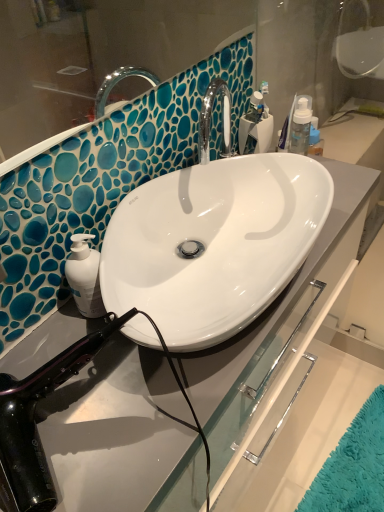
Describe the element at coordinates (256, 126) in the screenshot. This screenshot has height=512, width=384. I see `clear plastic toothbrush holder at upper right` at that location.

Image resolution: width=384 pixels, height=512 pixels. I want to click on clear plastic toothbrush holder at upper right, so click(256, 126).

At what (x,y) coordinates should I click in order to perform the action: click on black glossy hair dryer at lower left. Please return your answer as a coordinate pair (x, y). The image size is (384, 512). Looking at the image, I should click on (35, 423).

The height and width of the screenshot is (512, 384). What do you see at coordinates (35, 423) in the screenshot?
I see `black glossy hair dryer at lower left` at bounding box center [35, 423].

Measure the distance between point (37, 385) and camera.

The depth of point (37, 385) is 28.23 inches.

What are the coordinates of `clear plastic toothbrush holder at upper right` in the screenshot? It's located at (x=256, y=126).

Can you confirm if black glossy hair dryer at lower left is positioned to the left of clear plastic toothbrush holder at upper right?

Yes, black glossy hair dryer at lower left is to the left of clear plastic toothbrush holder at upper right.

Considering the relative positions of black glossy hair dryer at lower left and clear plastic toothbrush holder at upper right in the image provided, is black glossy hair dryer at lower left behind clear plastic toothbrush holder at upper right?

No.

Which is in front, point (3, 447) or point (242, 132)?

The point (3, 447) is in front.

From the image's perspective, does black glossy hair dryer at lower left appear higher than clear plastic toothbrush holder at upper right?

No, from the image's perspective, black glossy hair dryer at lower left is not on top of clear plastic toothbrush holder at upper right.

In the scene shown: From a real-world perspective, between black glossy hair dryer at lower left and clear plastic toothbrush holder at upper right, who is vertically lower?

clear plastic toothbrush holder at upper right.

Considering the sizes of black glossy hair dryer at lower left and clear plastic toothbrush holder at upper right in the image, is black glossy hair dryer at lower left wider or thinner than clear plastic toothbrush holder at upper right?

Considering their sizes, black glossy hair dryer at lower left looks broader than clear plastic toothbrush holder at upper right.

Between black glossy hair dryer at lower left and clear plastic toothbrush holder at upper right, which one has more height?

Standing taller between the two is black glossy hair dryer at lower left.

Does black glossy hair dryer at lower left have a larger size compared to clear plastic toothbrush holder at upper right?

Yes.

Do you think black glossy hair dryer at lower left is within clear plastic toothbrush holder at upper right, or outside of it?

The correct answer is: outside.

Is black glossy hair dryer at lower left next to clear plastic toothbrush holder at upper right and touching it?

black glossy hair dryer at lower left and clear plastic toothbrush holder at upper right are not in contact.

Is black glossy hair dryer at lower left aimed at clear plastic toothbrush holder at upper right?

No, black glossy hair dryer at lower left is not oriented towards clear plastic toothbrush holder at upper right.

This screenshot has height=512, width=384. In the image, there is a clear plastic toothbrush holder at upper right. In order to click on hair drier below it (from the image's perspective) in this screenshot , I will do `click(35, 423)`.

In the image, is clear plastic toothbrush holder at upper right on the left side or the right side of black glossy hair dryer at lower left?

clear plastic toothbrush holder at upper right is positioned on black glossy hair dryer at lower left's right side.

Which object is more forward, clear plastic toothbrush holder at upper right or black glossy hair dryer at lower left?

black glossy hair dryer at lower left is more forward.

Between point (262, 120) and point (124, 316), which one is positioned behind?

Point (262, 120)

Consider the image. From the image's perspective, is clear plastic toothbrush holder at upper right on top of black glossy hair dryer at lower left?

Yes, from the image's perspective, clear plastic toothbrush holder at upper right is above black glossy hair dryer at lower left.

From the picture: From a real-world perspective, is clear plastic toothbrush holder at upper right positioned under black glossy hair dryer at lower left based on gravity?

Yes.

Is clear plastic toothbrush holder at upper right wider than black glossy hair dryer at lower left?

No.

Between clear plastic toothbrush holder at upper right and black glossy hair dryer at lower left, which one has less height?

Standing shorter between the two is clear plastic toothbrush holder at upper right.

Who is smaller, clear plastic toothbrush holder at upper right or black glossy hair dryer at lower left?

Answer: Smaller between the two is clear plastic toothbrush holder at upper right.

Is clear plastic toothbrush holder at upper right inside the boundaries of black glossy hair dryer at lower left, or outside?

clear plastic toothbrush holder at upper right is not inside black glossy hair dryer at lower left, it's outside.

From the picture: Would you consider clear plastic toothbrush holder at upper right to be distant from black glossy hair dryer at lower left?

clear plastic toothbrush holder at upper right is near black glossy hair dryer at lower left, not far away.

Could you tell me if clear plastic toothbrush holder at upper right is turned towards black glossy hair dryer at lower left?

No, clear plastic toothbrush holder at upper right is not aimed at black glossy hair dryer at lower left.

The image size is (384, 512). In order to click on hair drier that is in front of the clear plastic toothbrush holder at upper right in this screenshot , I will do `click(35, 423)`.

Find the location of `toiletry that appears behind the black glossy hair dryer at lower left`. toiletry that appears behind the black glossy hair dryer at lower left is located at coordinates (256, 126).

At what (x,y) coordinates should I click in order to perform the action: click on toiletry that appears below the black glossy hair dryer at lower left (from a real-world perspective). Please return your answer as a coordinate pair (x, y). The image size is (384, 512). Looking at the image, I should click on (256, 126).